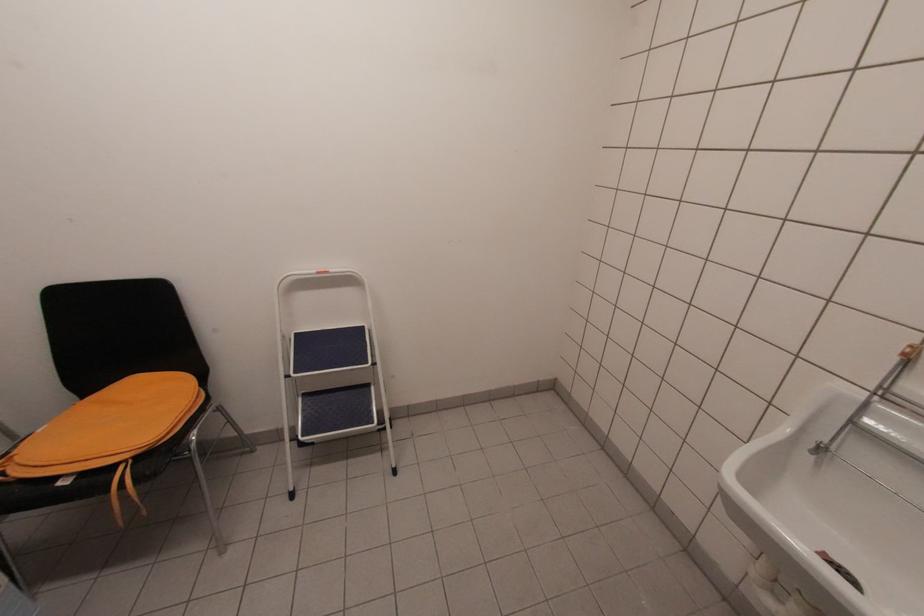
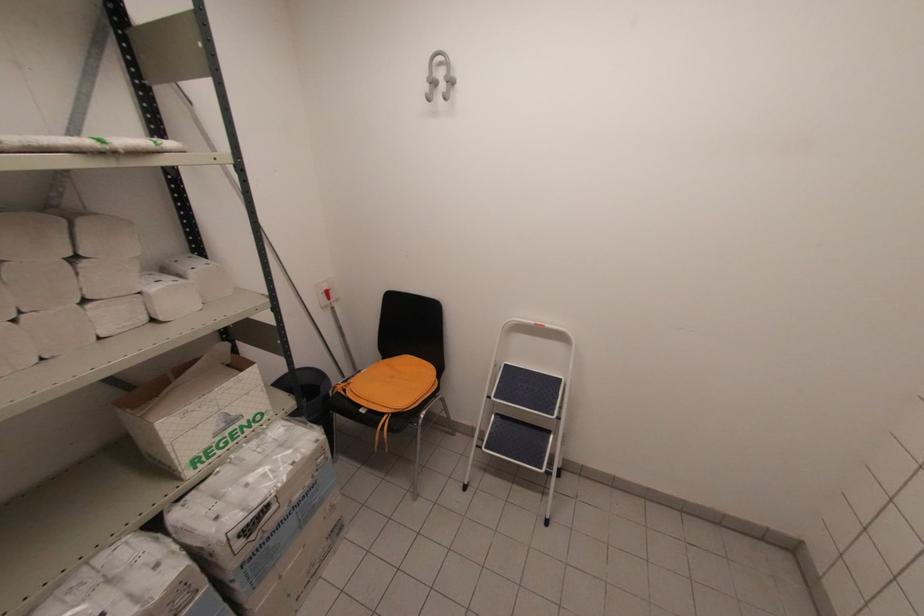
Find the pixel in the second image that matches the point at 297,334 in the first image.

(506, 366)